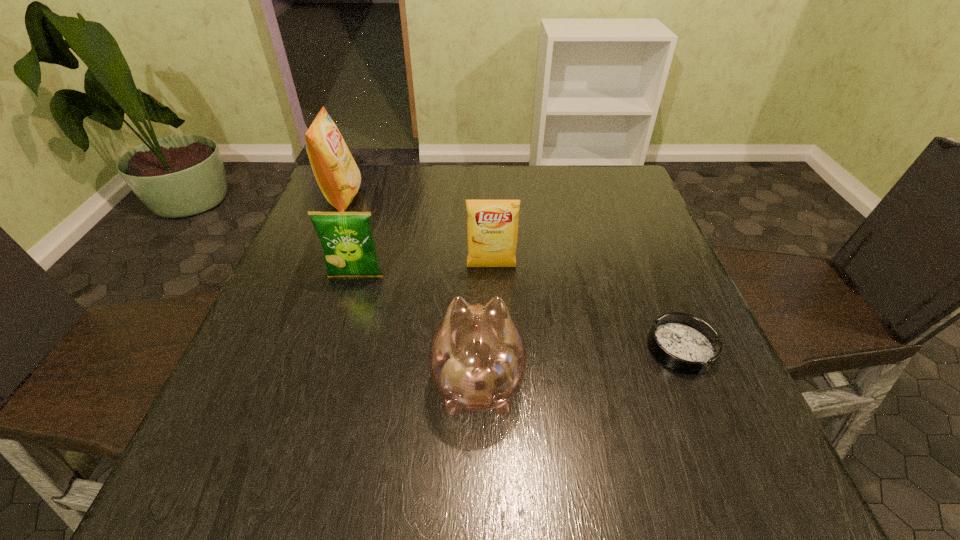
Where is `vacant space at the far right corner of the desktop`? The width and height of the screenshot is (960, 540). vacant space at the far right corner of the desktop is located at coordinates (610, 199).

Identify the location of blank area at the near right corner. The image size is (960, 540). (728, 477).

At what (x,y) coordinates should I click in order to perform the action: click on free area in between the tallest object and the piggy bank. Please return your answer as a coordinate pair (x, y). Looking at the image, I should click on (411, 290).

Image resolution: width=960 pixels, height=540 pixels. In order to click on free space between the piggy bank and the farthest crisp (potato chip) in this screenshot , I will do `click(411, 290)`.

Identify the location of vacant space that's between the shortest object and the piggy bank. (580, 364).

Where is `free spot between the piggy bank and the shortest object`? This screenshot has height=540, width=960. free spot between the piggy bank and the shortest object is located at coordinates (580, 364).

I want to click on vacant area that lies between the farthest object and the ashtray, so click(x=512, y=273).

The width and height of the screenshot is (960, 540). What are the coordinates of `blank region between the rightmost crisp (potato chip) and the rightmost object` in the screenshot? It's located at (587, 308).

This screenshot has height=540, width=960. Find the location of `free space between the piggy bank and the farthest object`. free space between the piggy bank and the farthest object is located at coordinates (411, 290).

Locate an element on the screen. The height and width of the screenshot is (540, 960). object identified as the second closest to the shortest object is located at coordinates (492, 226).